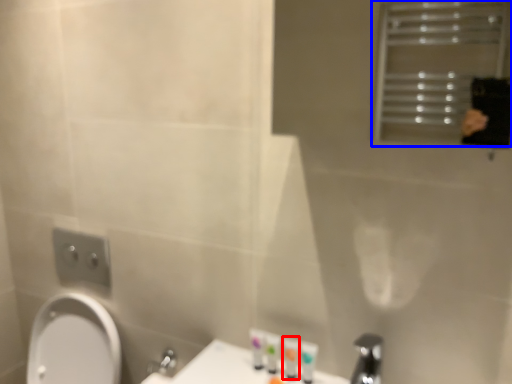
Question: Which object is closer to the camera taking this photo, toiletry (highlighted by a red box) or screen door (highlighted by a blue box)?

Choices:
 (A) toiletry
 (B) screen door

Answer: (B)